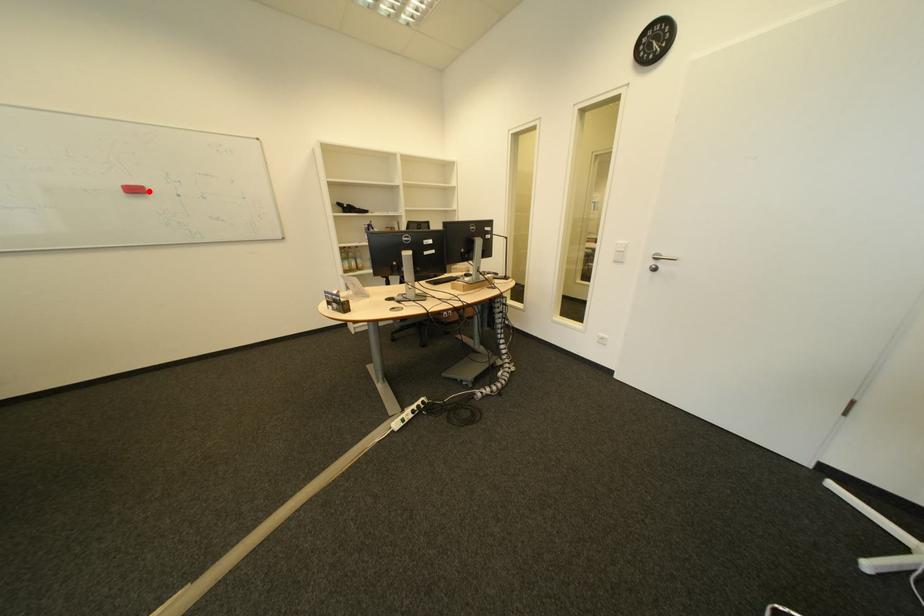
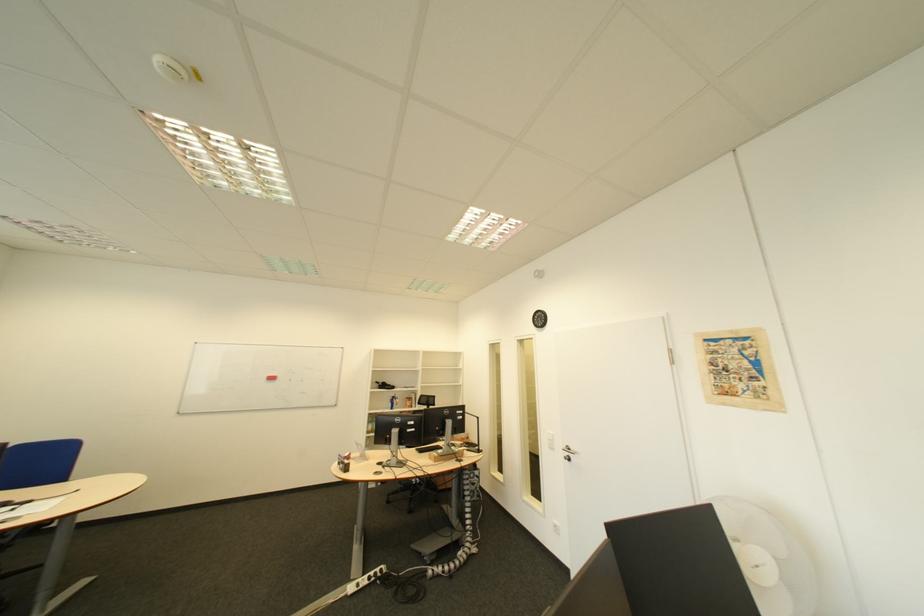
The point at the highlighted location is marked in the first image. Where is the corresponding point in the second image?

(285, 379)